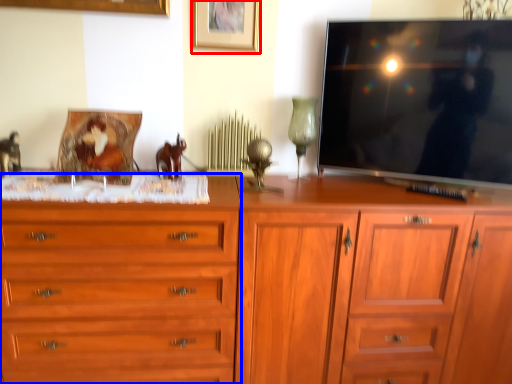
Question: Which object is further to the camera taking this photo, picture frame (highlighted by a red box) or chest of drawers (highlighted by a blue box)?

Choices:
 (A) picture frame
 (B) chest of drawers

Answer: (A)